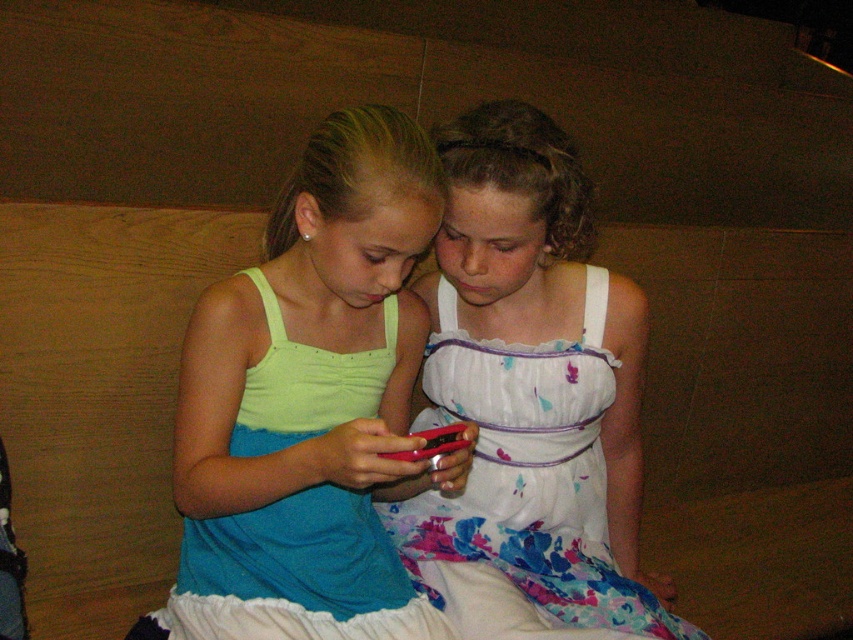
In the scene shown: Measure the distance between matte green tank top at center and camera.

A distance of 94.97 centimeters exists between matte green tank top at center and camera.

Who is taller, matte green tank top at center or white floral fabric dress at center?

Standing taller between the two is matte green tank top at center.

Is point (337, 627) positioned before point (585, 625)?

Yes, point (337, 627) is in front of point (585, 625).

Locate an element on the screen. The height and width of the screenshot is (640, 853). matte green tank top at center is located at coordinates (309, 404).

Is matte green tank top at center closer to camera compared to matte red phone at center?

Yes, matte green tank top at center is closer to the viewer.

Between point (320, 628) and point (428, 440), which one is positioned in front?

Point (428, 440) is more forward.

Who is more distant from viewer, (389,424) or (450,433)?

Positioned behind is point (389,424).

The width and height of the screenshot is (853, 640). In order to click on matte green tank top at center in this screenshot , I will do `click(309, 404)`.

Which is in front, point (538, 596) or point (454, 444)?

Point (454, 444)

Does white floral fabric dress at center lie behind matte red phone at center?

Yes.

Identify the location of white floral fabric dress at center. (525, 486).

Where is `white floral fabric dress at center`? white floral fabric dress at center is located at coordinates (525, 486).